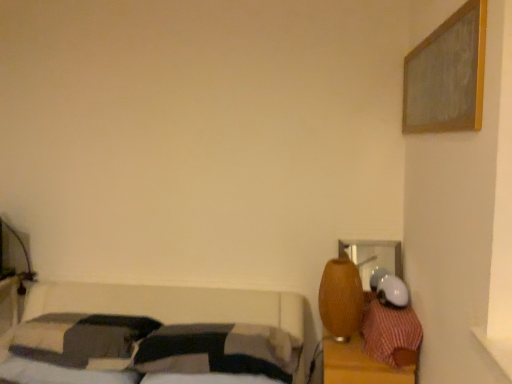
Question: From the image's perspective, is soft cotton pillow at center, marked as the 2th pillow in a left-to-right arrangement, positioned above or below dark gray fabric pillow at lower left, the 1th pillow positioned from the left?

Choices:
 (A) below
 (B) above

Answer: (A)

Question: Is soft cotton pillow at center, marked as the 2th pillow in a left-to-right arrangement, taller or shorter than dark gray fabric pillow at lower left, the 1th pillow positioned from the left?

Choices:
 (A) short
 (B) tall

Answer: (A)

Question: Which is nearer to the braided wood table lamp at right?

Choices:
 (A) dark gray fabric pillow at lower left, the 1th pillow positioned from the left
 (B) wooden dresser at right
 (C) red plaid pillow at right, which is the first pillow from right to left
 (D) soft cotton pillow at center, positioned as the second pillow in right-to-left order

Answer: (B)

Question: Considering the real-world distances, which object is closest to the soft cotton pillow at center, positioned as the second pillow in right-to-left order?

Choices:
 (A) red plaid pillow at right, which is the first pillow from right to left
 (B) wooden dresser at right
 (C) dark gray fabric pillow at lower left, placed as the third pillow when sorted from right to left
 (D) braided wood table lamp at right

Answer: (C)